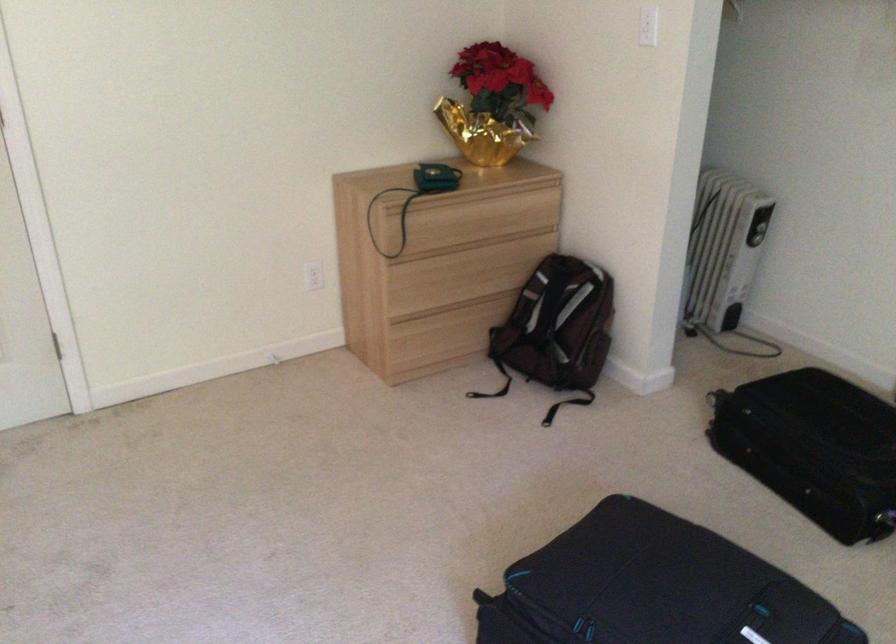
What do you see at coordinates (883, 509) in the screenshot? I see `the black suitcase handle` at bounding box center [883, 509].